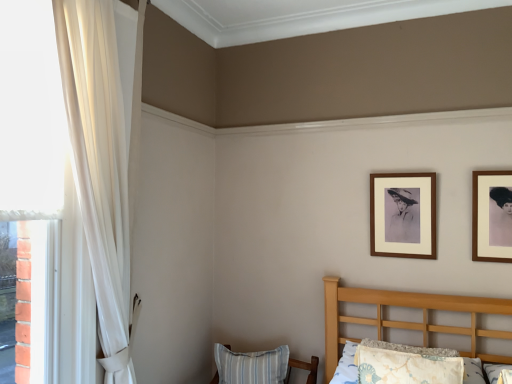
This screenshot has height=384, width=512. Describe the element at coordinates (492, 216) in the screenshot. I see `wooden picture frame at upper right, positioned as the 1th picture frame in right-to-left order` at that location.

What do you see at coordinates (406, 367) in the screenshot?
I see `fluffy white pillow at lower right, the second pillow from the bottom` at bounding box center [406, 367].

This screenshot has width=512, height=384. Describe the element at coordinates (99, 166) in the screenshot. I see `sheer white curtain at left` at that location.

You are a GUI agent. You are given a task and a screenshot of the screen. Output one action in this format:
    pyautogui.click(x=<x>, y=<y>)
    Task: Click on the blue striped pillow at lower center, the 1th pillow when ordered from left to right
    
    Given the screenshot: What is the action you would take?
    pyautogui.click(x=251, y=365)

From a real-world perspective, is fluffy white pillow at lower right, which is the 1th pillow from front to back, above or below blue striped pillow at lower center, the second pillow positioned from the front?

fluffy white pillow at lower right, which is the 1th pillow from front to back, is above blue striped pillow at lower center, the second pillow positioned from the front.

How far apart are fluffy white pillow at lower right, the second pillow from the bottom, and blue striped pillow at lower center, the second pillow positioned from the front?

fluffy white pillow at lower right, the second pillow from the bottom, is 31.96 inches from blue striped pillow at lower center, the second pillow positioned from the front.

Can you tell me how much fluffy white pillow at lower right, the 2th pillow in the back-to-front sequence, and blue striped pillow at lower center, which appears as the 1th pillow when viewed from the back, differ in facing direction?

fluffy white pillow at lower right, the 2th pillow in the back-to-front sequence, and blue striped pillow at lower center, which appears as the 1th pillow when viewed from the back, are facing 2.4 degrees away from each other.

Could you tell me if fluffy white pillow at lower right, which is the 1th pillow from front to back, is facing blue striped pillow at lower center, the first pillow positioned from the bottom?

No, fluffy white pillow at lower right, which is the 1th pillow from front to back, is not turned towards blue striped pillow at lower center, the first pillow positioned from the bottom.

Visually, is wooden picture frame at upper right, the 1th picture frame in the front-to-back sequence, positioned to the left or to the right of blue striped pillow at lower center, which appears as the second pillow when viewed from the right?

In the image, wooden picture frame at upper right, the 1th picture frame in the front-to-back sequence, appears on the right side of blue striped pillow at lower center, which appears as the second pillow when viewed from the right.

Is wooden picture frame at upper right, positioned as the second picture frame in left-to-right order, in front of or behind blue striped pillow at lower center, the first pillow positioned from the bottom, in the image?

In the image, wooden picture frame at upper right, positioned as the second picture frame in left-to-right order, appears in front of blue striped pillow at lower center, the first pillow positioned from the bottom.

This screenshot has height=384, width=512. In order to click on pillow behind the wooden picture frame at upper right, positioned as the 1th picture frame in right-to-left order in this screenshot , I will do `click(251, 365)`.

Could you measure the distance between wooden picture frame at upper right, the 1th picture frame in the front-to-back sequence, and blue striped pillow at lower center, the second pillow positioned from the front?

wooden picture frame at upper right, the 1th picture frame in the front-to-back sequence, and blue striped pillow at lower center, the second pillow positioned from the front, are 4.38 feet apart.

Looking at this image, in the image, is wooden picture frame at upper right, positioned as the second picture frame in left-to-right order, on the left side or the right side of sheer white curtain at left?

Based on their positions, wooden picture frame at upper right, positioned as the second picture frame in left-to-right order, is located to the right of sheer white curtain at left.

Is point (483, 248) positioned in front of point (83, 41)?

No.

Could you tell me if wooden picture frame at upper right, positioned as the second picture frame in left-to-right order, is turned towards sheer white curtain at left?

No, wooden picture frame at upper right, positioned as the second picture frame in left-to-right order, is not turned towards sheer white curtain at left.

Would you say brown wooden picture frame at upper right, which is counted as the second picture frame, starting from the right, is outside blue striped pillow at lower center, the second pillow positioned from the front?

brown wooden picture frame at upper right, which is counted as the second picture frame, starting from the right, lies outside blue striped pillow at lower center, the second pillow positioned from the front,'s area.

From the image's perspective, is brown wooden picture frame at upper right, which is the 1th picture frame from back to front, above blue striped pillow at lower center, the second pillow positioned from the front?

Yes, from the image's perspective, brown wooden picture frame at upper right, which is the 1th picture frame from back to front, is on top of blue striped pillow at lower center, the second pillow positioned from the front.

Is brown wooden picture frame at upper right, which is the 2th picture frame in front-to-back order, to the right of blue striped pillow at lower center, which appears as the second pillow when viewed from the right, from the viewer's perspective?

Yes.

Where is `picture frame below the brown wooden picture frame at upper right, which is counted as the first picture frame, starting from the left (from a real-world perspective)`? This screenshot has height=384, width=512. picture frame below the brown wooden picture frame at upper right, which is counted as the first picture frame, starting from the left (from a real-world perspective) is located at coordinates [492, 216].

Which is behind, point (370, 207) or point (501, 187)?

The point (370, 207) is more distant.

Measure the distance between brown wooden picture frame at upper right, which is the 2th picture frame in front-to-back order, and wooden picture frame at upper right, positioned as the 1th picture frame in right-to-left order.

brown wooden picture frame at upper right, which is the 2th picture frame in front-to-back order, and wooden picture frame at upper right, positioned as the 1th picture frame in right-to-left order, are 31.90 centimeters apart from each other.

From a real-world perspective, relative to wooden picture frame at upper right, positioned as the second picture frame in left-to-right order, is brown wooden picture frame at upper right, which is counted as the first picture frame, starting from the left, vertically above or below?

From a real-world perspective, brown wooden picture frame at upper right, which is counted as the first picture frame, starting from the left, is physically above wooden picture frame at upper right, positioned as the second picture frame in left-to-right order.

How many degrees apart are the facing directions of blue striped pillow at lower center, which appears as the 1th pillow when viewed from the back, and brown wooden picture frame at upper right, which is the 2th picture frame in front-to-back order?

The angular difference between blue striped pillow at lower center, which appears as the 1th pillow when viewed from the back, and brown wooden picture frame at upper right, which is the 2th picture frame in front-to-back order, is 2.85 degrees.

Which object is wider, blue striped pillow at lower center, the 1th pillow when ordered from left to right, or brown wooden picture frame at upper right, which is counted as the second picture frame, starting from the right?

blue striped pillow at lower center, the 1th pillow when ordered from left to right, is wider.

Is blue striped pillow at lower center, the first pillow positioned from the bottom, not inside brown wooden picture frame at upper right, which is counted as the second picture frame, starting from the right?

Yes, blue striped pillow at lower center, the first pillow positioned from the bottom, is located beyond the bounds of brown wooden picture frame at upper right, which is counted as the second picture frame, starting from the right.

How far apart are blue striped pillow at lower center, the first pillow positioned from the bottom, and brown wooden picture frame at upper right, which is the 1th picture frame from back to front?

39.30 inches.

From the image's perspective, which one is positioned higher, brown wooden picture frame at upper right, which is counted as the first picture frame, starting from the left, or sheer white curtain at left?

sheer white curtain at left is shown above in the image.

From the picture: Considering the relative sizes of brown wooden picture frame at upper right, which is counted as the first picture frame, starting from the left, and sheer white curtain at left in the image provided, is brown wooden picture frame at upper right, which is counted as the first picture frame, starting from the left, shorter than sheer white curtain at left?

Yes, brown wooden picture frame at upper right, which is counted as the first picture frame, starting from the left, is shorter than sheer white curtain at left.

Which object is positioned more to the left, brown wooden picture frame at upper right, which is counted as the second picture frame, starting from the right, or sheer white curtain at left?

From the viewer's perspective, sheer white curtain at left appears more on the left side.

Which of these two, brown wooden picture frame at upper right, which is counted as the first picture frame, starting from the left, or sheer white curtain at left, is wider?

With larger width is sheer white curtain at left.

Find the location of `pillow on the right of blue striped pillow at lower center, which is counted as the second pillow, starting from the top`. pillow on the right of blue striped pillow at lower center, which is counted as the second pillow, starting from the top is located at coordinates (406, 367).

Which picture frame is the 2nd one when counting from the front of the blue striped pillow at lower center, which appears as the 1th pillow when viewed from the back? Please provide its 2D coordinates.

[(492, 216)]

Estimate the real-world distances between objects in this image. Which object is closer to sheer white curtain at left, blue striped pillow at lower center, which appears as the second pillow when viewed from the right, or wooden picture frame at upper right, which is the second picture frame in back-to-front order?

blue striped pillow at lower center, which appears as the second pillow when viewed from the right.

Estimate the real-world distances between objects in this image. Which object is further from sheer white curtain at left, wooden picture frame at upper right, which is the second picture frame in back-to-front order, or brown wooden picture frame at upper right, which is the 1th picture frame from back to front?

The object further to sheer white curtain at left is wooden picture frame at upper right, which is the second picture frame in back-to-front order.

Which object lies nearer to the anchor point sheer white curtain at left, fluffy white pillow at lower right, the second pillow from the bottom, or blue striped pillow at lower center, the 1th pillow when ordered from left to right?

blue striped pillow at lower center, the 1th pillow when ordered from left to right, is closer to sheer white curtain at left.

Considering their positions, is brown wooden picture frame at upper right, which is the 1th picture frame from back to front, positioned further to blue striped pillow at lower center, the 1th pillow when ordered from left to right, than sheer white curtain at left?

sheer white curtain at left is positioned further to the anchor blue striped pillow at lower center, the 1th pillow when ordered from left to right.

Estimate the real-world distances between objects in this image. Which object is further from fluffy white pillow at lower right, placed as the 1th pillow when sorted from top to bottom, sheer white curtain at left or brown wooden picture frame at upper right, which is counted as the second picture frame, starting from the right?

sheer white curtain at left is further to fluffy white pillow at lower right, placed as the 1th pillow when sorted from top to bottom.

Looking at the image, which one is located further to wooden picture frame at upper right, the 1th picture frame in the front-to-back sequence, blue striped pillow at lower center, the first pillow positioned from the bottom, or fluffy white pillow at lower right, the second pillow from the bottom?

blue striped pillow at lower center, the first pillow positioned from the bottom, is further to wooden picture frame at upper right, the 1th picture frame in the front-to-back sequence.

When comparing their distances from brown wooden picture frame at upper right, which is the 1th picture frame from back to front, does blue striped pillow at lower center, the second pillow positioned from the front, or fluffy white pillow at lower right, the 2th pillow in the back-to-front sequence, seem further?

blue striped pillow at lower center, the second pillow positioned from the front, is positioned further to the anchor brown wooden picture frame at upper right, which is the 1th picture frame from back to front.

When comparing their distances from brown wooden picture frame at upper right, which is counted as the first picture frame, starting from the left, does wooden picture frame at upper right, positioned as the 1th picture frame in right-to-left order, or fluffy white pillow at lower right, placed as the 1th pillow when sorted from top to bottom, seem closer?

Based on the image, wooden picture frame at upper right, positioned as the 1th picture frame in right-to-left order, appears to be nearer to brown wooden picture frame at upper right, which is counted as the first picture frame, starting from the left.

You are a GUI agent. You are given a task and a screenshot of the screen. Output one action in this format:
    pyautogui.click(x=<x>, y=<y>)
    Task: Click on the pillow between brown wooden picture frame at upper right, which is the 2th picture frame in front-to-back order, and blue striped pillow at lower center, the 1th pillow when ordered from left to right, in the up-down direction
    The image size is (512, 384).
    Given the screenshot: What is the action you would take?
    pyautogui.click(x=406, y=367)

At what (x,y) coordinates should I click in order to perform the action: click on picture frame located between blue striped pillow at lower center, which appears as the 1th pillow when viewed from the back, and wooden picture frame at upper right, which is the second picture frame in back-to-front order, in the left-right direction. Please return your answer as a coordinate pair (x, y). This screenshot has width=512, height=384. Looking at the image, I should click on (403, 215).

The image size is (512, 384). In order to click on pillow between sheer white curtain at left and fluffy white pillow at lower right, the first pillow in the right-to-left sequence in this screenshot , I will do click(251, 365).

You are a GUI agent. You are given a task and a screenshot of the screen. Output one action in this format:
    pyautogui.click(x=<x>, y=<y>)
    Task: Click on the picture frame located between fluffy white pillow at lower right, the second pillow from the bottom, and brown wooden picture frame at upper right, which is the 2th picture frame in front-to-back order, in the depth direction
    
    Given the screenshot: What is the action you would take?
    pyautogui.click(x=492, y=216)